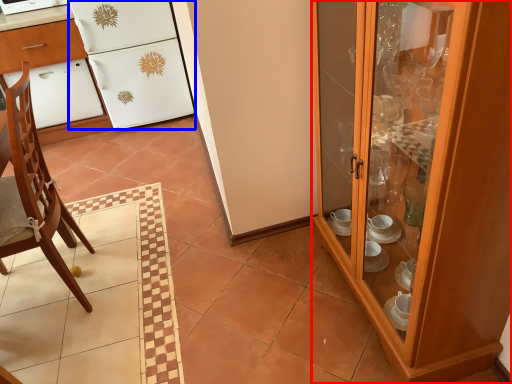
Question: Which object is further to the camera taking this photo, cabinetry (highlighted by a red box) or refrigerator (highlighted by a blue box)?

Choices:
 (A) cabinetry
 (B) refrigerator

Answer: (B)